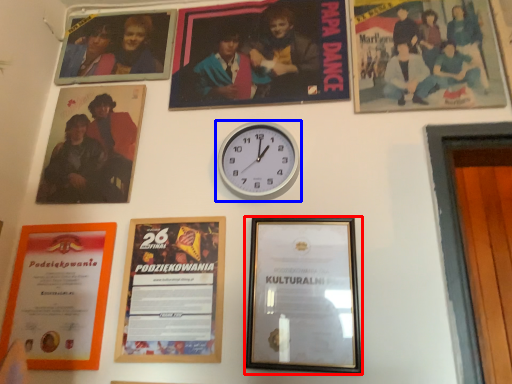
Question: Which point is further to the camera, picture frame (highlighted by a red box) or wall clock (highlighted by a blue box)?

Choices:
 (A) picture frame
 (B) wall clock

Answer: (B)